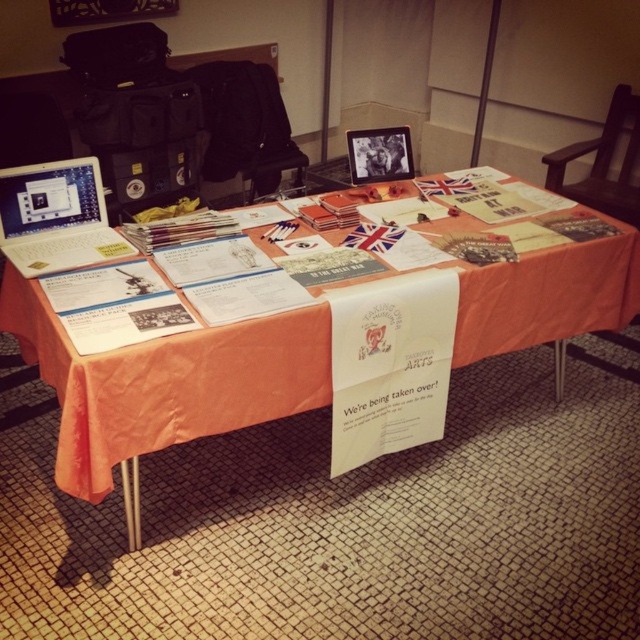
Question: Is orange fabric tablecloth at center positioned in front of silver metallic laptop at left?

Choices:
 (A) yes
 (B) no

Answer: (A)

Question: Can you confirm if silver metallic laptop at left is bigger than matte black tablet at upper center?

Choices:
 (A) yes
 (B) no

Answer: (B)

Question: Is orange fabric tablecloth at center wider than matte black tablet at upper center?

Choices:
 (A) no
 (B) yes

Answer: (B)

Question: Based on their relative distances, which object is nearer to the orange fabric tablecloth at center?

Choices:
 (A) matte black tablet at upper center
 (B) silver metallic laptop at left

Answer: (B)

Question: Which point is closer to the camera taking this photo?

Choices:
 (A) (104, 237)
 (B) (310, 177)

Answer: (A)

Question: Which point is farther from the camera taking this photo?

Choices:
 (A) (376, 164)
 (B) (280, 321)

Answer: (A)